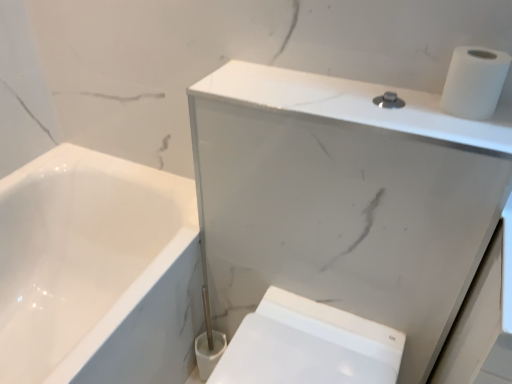
At what (x,y) coordinates should I click in order to perform the action: click on free location in front of white matte toilet paper at upper right. Please return your answer as a coordinate pair (x, y). Looking at the image, I should click on (472, 129).